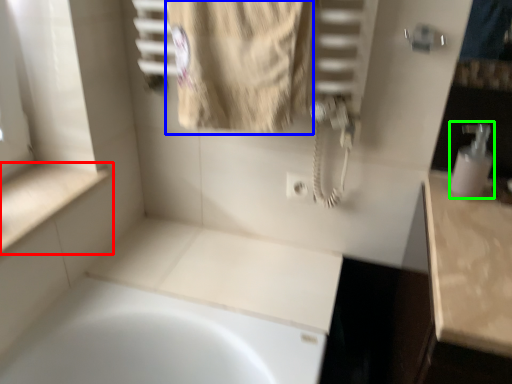
Question: Estimate the real-world distances between objects in this image. Which object is farther from counter top (highlighted by a red box), bath towel (highlighted by a blue box) or soap dispenser (highlighted by a green box)?

Choices:
 (A) bath towel
 (B) soap dispenser

Answer: (B)